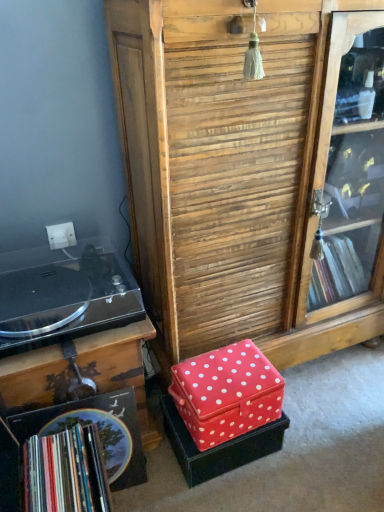
Question: From the image's perspective, is multicolored paper book at lower left beneath wooden at center?

Choices:
 (A) yes
 (B) no

Answer: (A)

Question: Would you say multicolored paper book at lower left is outside wooden at center?

Choices:
 (A) yes
 (B) no

Answer: (A)

Question: Is multicolored paper book at lower left oriented towards wooden at center?

Choices:
 (A) no
 (B) yes

Answer: (A)

Question: From a real-world perspective, is multicolored paper book at lower left below wooden at center?

Choices:
 (A) no
 (B) yes

Answer: (B)

Question: Does multicolored paper book at lower left have a smaller size compared to wooden at center?

Choices:
 (A) no
 (B) yes

Answer: (B)

Question: Can you confirm if multicolored paper book at lower left is thinner than wooden at center?

Choices:
 (A) no
 (B) yes

Answer: (B)

Question: Does red fabric box at lower center, which is the 2th storage box in bottom-to-top order, appear on the left side of multicolored paper book at lower left?

Choices:
 (A) yes
 (B) no

Answer: (B)

Question: Can you confirm if red fabric box at lower center, which is the 2th storage box in bottom-to-top order, is positioned to the right of multicolored paper book at lower left?

Choices:
 (A) no
 (B) yes

Answer: (B)

Question: Is red fabric box at lower center, which is the 1th storage box from top to bottom, not near multicolored paper book at lower left?

Choices:
 (A) no
 (B) yes

Answer: (A)

Question: Is red fabric box at lower center, which is the 2th storage box in bottom-to-top order, turned away from multicolored paper book at lower left?

Choices:
 (A) yes
 (B) no

Answer: (B)

Question: Is red fabric box at lower center, which is the 1th storage box from top to bottom, positioned before multicolored paper book at lower left?

Choices:
 (A) no
 (B) yes

Answer: (A)

Question: Considering the relative sizes of red fabric box at lower center, which is the 2th storage box in bottom-to-top order, and multicolored paper book at lower left in the image provided, is red fabric box at lower center, which is the 2th storage box in bottom-to-top order, smaller than multicolored paper book at lower left?

Choices:
 (A) yes
 (B) no

Answer: (A)

Question: Does wooden at center have a lesser height compared to red fabric box at center, the first storage box positioned from the bottom?

Choices:
 (A) yes
 (B) no

Answer: (B)